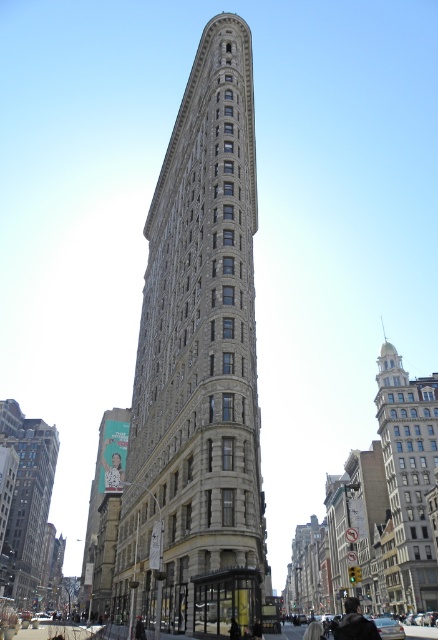
Is silver metallic building at right above gray stone building at center?

Yes.

Which is in front, point (399, 483) or point (31, 580)?

Point (399, 483)

What are the coordinates of `silver metallic building at right` in the screenshot? It's located at (409, 474).

Locate an element on the screen. This screenshot has width=438, height=640. silver metallic building at right is located at coordinates click(409, 474).

Between stone textured building at center and silver metallic building at right, which one appears on the right side from the viewer's perspective?

Positioned to the right is silver metallic building at right.

Where is `stone textured building at center`? stone textured building at center is located at coordinates point(198,365).

Who is positioned more to the right, stone textured building at center or gray stone building at center?

From the viewer's perspective, stone textured building at center appears more on the right side.

Does stone textured building at center have a greater width compared to gray stone building at center?

Correct, the width of stone textured building at center exceeds that of gray stone building at center.

Is point (194, 612) positioned before point (29, 586)?

Yes, it is in front of point (29, 586).

What are the coordinates of `stone textured building at center` in the screenshot? It's located at (198, 365).